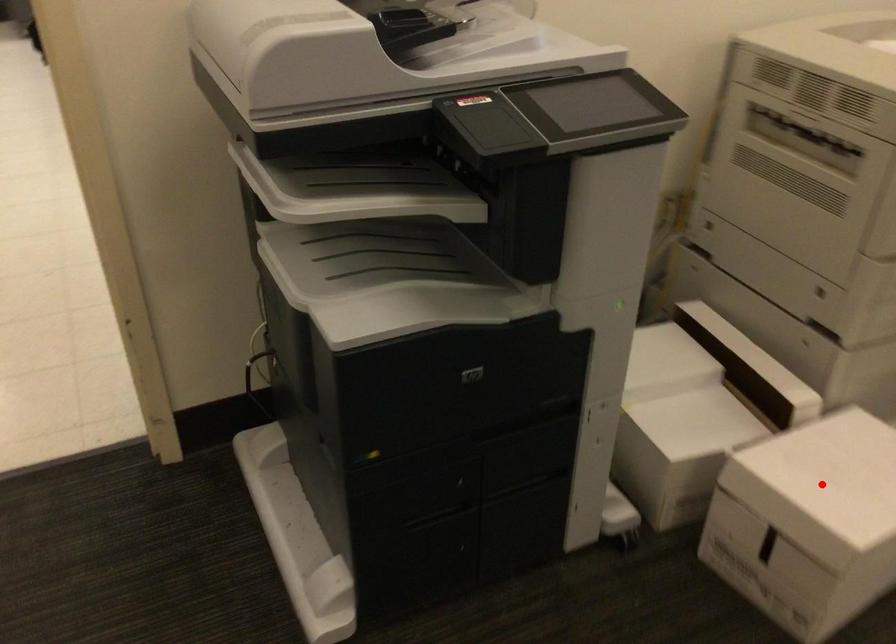
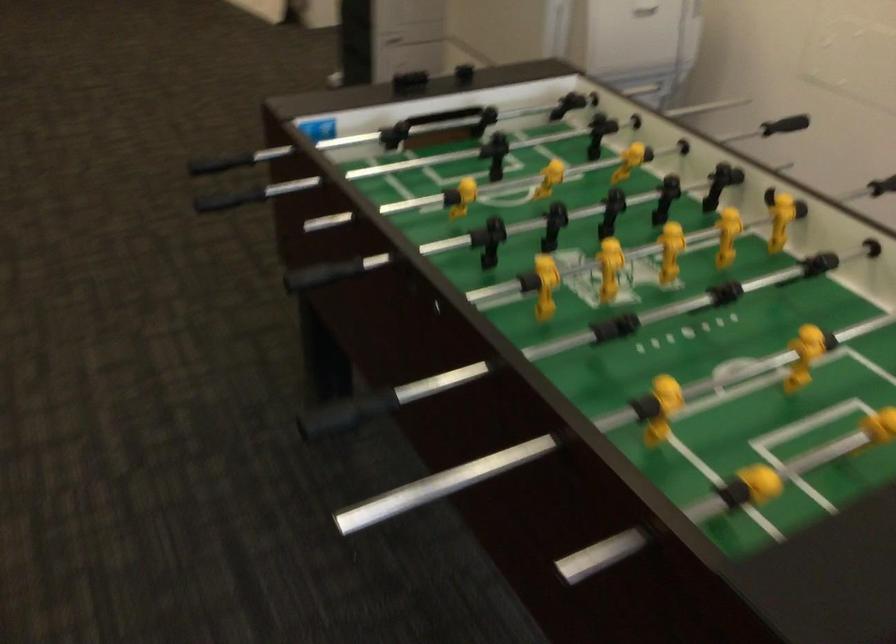
Question: I am providing you with two images of the same scene from different viewpoints. A red point is marked on the first image. Is the red point's position out of view in image 2?

Choices:
 (A) Yes
 (B) No

Answer: (A)